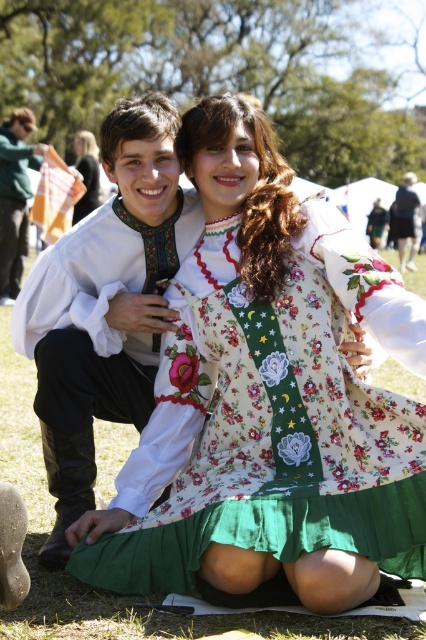
Does white satin shirt at center have a larger size compared to matte black shirt at left?

Incorrect, white satin shirt at center is not larger than matte black shirt at left.

Which of these two, white satin shirt at center or matte black shirt at left, stands shorter?

white satin shirt at center is shorter.

What do you see at coordinates (106, 305) in the screenshot? This screenshot has width=426, height=640. I see `white satin shirt at center` at bounding box center [106, 305].

Identify the location of white satin shirt at center. (106, 305).

You are a GUI agent. You are given a task and a screenshot of the screen. Output one action in this format:
    pyautogui.click(x=<x>, y=<y>)
    Task: Click on the floral cotton dress at center
    The image size is (426, 640).
    Given the screenshot: What is the action you would take?
    pyautogui.click(x=273, y=419)

Between floral cotton dress at center and white satin shirt at center, which one appears on the left side from the viewer's perspective?

white satin shirt at center

Can you confirm if floral cotton dress at center is positioned to the right of white satin shirt at center?

Indeed, floral cotton dress at center is positioned on the right side of white satin shirt at center.

Is point (204, 337) positioned in front of point (172, 253)?

Yes, point (204, 337) is in front of point (172, 253).

Identify the location of floral cotton dress at center. This screenshot has width=426, height=640. (273, 419).